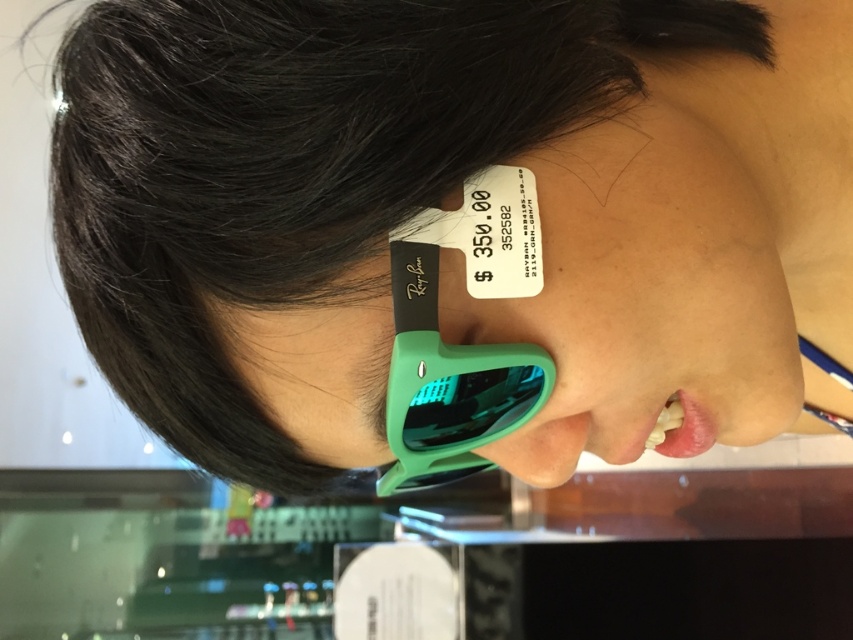
You are a customer in a sunglasses store. You see the black matte hair at upper left and the green matte sunglasses at center. Which object takes up more space in the image?

The black matte hair at upper left is bigger than the green matte sunglasses at center, so it takes up more space in the image.

You are a customer in an eyewear store. You see the black matte hair at upper left and the green matte sunglasses at center. Which object is taller?

The black matte hair at upper left has a greater height compared to the green matte sunglasses at center, so the black matte hair at upper left is taller.

Based on the photo, you are a customer in a sunglasses store. You see the black matte hair at upper left and the green matte sunglasses at center. Which object is nearer to you?

The black matte hair at upper left is closer to the viewer than the green matte sunglasses at center.